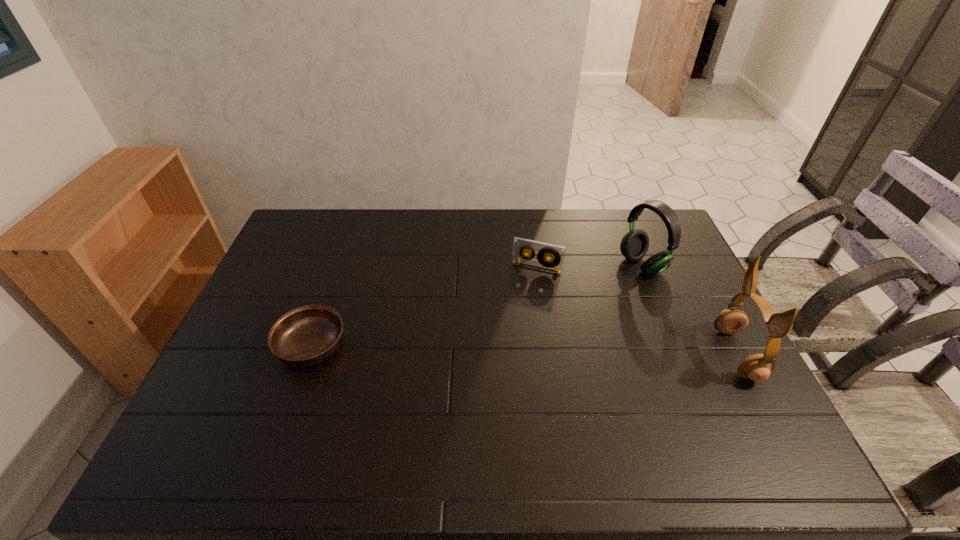
At what (x,y) coordinates should I click in order to perform the action: click on vacant space that satisfies the following two spatial constraints: 1. on the front side of the shortest object; 2. on the front-facing side of the earphone. Please return your answer as a coordinate pair (x, y). This screenshot has width=960, height=540. Looking at the image, I should click on (309, 354).

I want to click on vacant space that satisfies the following two spatial constraints: 1. on the front side of the earphone; 2. on the front-facing side of the third tallest object, so click(549, 354).

I want to click on free spot that satisfies the following two spatial constraints: 1. on the front side of the earphone; 2. on the front-facing side of the third object from right to left, so click(x=549, y=354).

Where is `free location that satisfies the following two spatial constraints: 1. on the front side of the earphone; 2. on the front-facing side of the third object from left to right`? The width and height of the screenshot is (960, 540). free location that satisfies the following two spatial constraints: 1. on the front side of the earphone; 2. on the front-facing side of the third object from left to right is located at coordinates (678, 354).